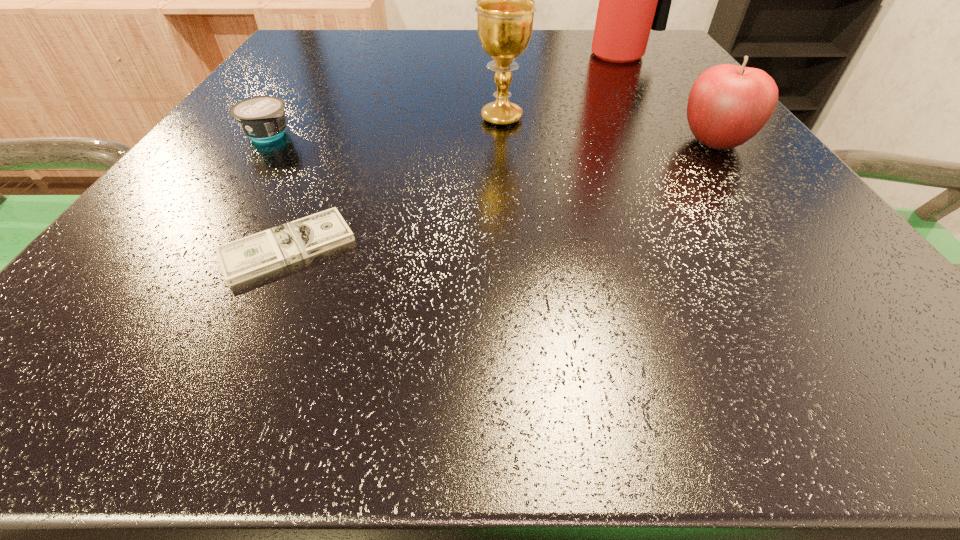
At what (x,y) coordinates should I click in order to perform the action: click on free space between the farthest object and the yogurt. Please return your answer as a coordinate pair (x, y). The height and width of the screenshot is (540, 960). Looking at the image, I should click on (444, 94).

This screenshot has width=960, height=540. Identify the location of vacant space that's between the second shortest object and the apple. (492, 138).

Where is `vacant space that's between the fire extinguisher and the shortest object`? The height and width of the screenshot is (540, 960). vacant space that's between the fire extinguisher and the shortest object is located at coordinates (453, 151).

I want to click on free space between the third object from right to left and the shortest object, so click(x=395, y=183).

Find the location of a particular element. The height and width of the screenshot is (540, 960). object that is the fourth closest to the shortest object is located at coordinates (633, 0).

Select which object appears as the third closest to the nearest object. Please provide its 2D coordinates. Your answer should be formatted as a tuple, i.e. [(x, y)], where the tuple contains the x and y coordinates of a point satisfying the conditions above.

[(728, 105)]

At what (x,y) coordinates should I click in order to perform the action: click on free space that satisfies the following two spatial constraints: 1. on the back side of the fourth shortest object; 2. on the left side of the fourth tallest object. Please return your answer as a coordinate pair (x, y). Looking at the image, I should click on (280, 118).

In order to click on vacant area in the image that satisfies the following two spatial constraints: 1. on the back side of the dollar; 2. on the left side of the second tallest object in this screenshot , I will do `click(346, 118)`.

I want to click on vacant space that satisfies the following two spatial constraints: 1. on the back side of the second tallest object; 2. on the left side of the second shortest object, so click(x=280, y=118).